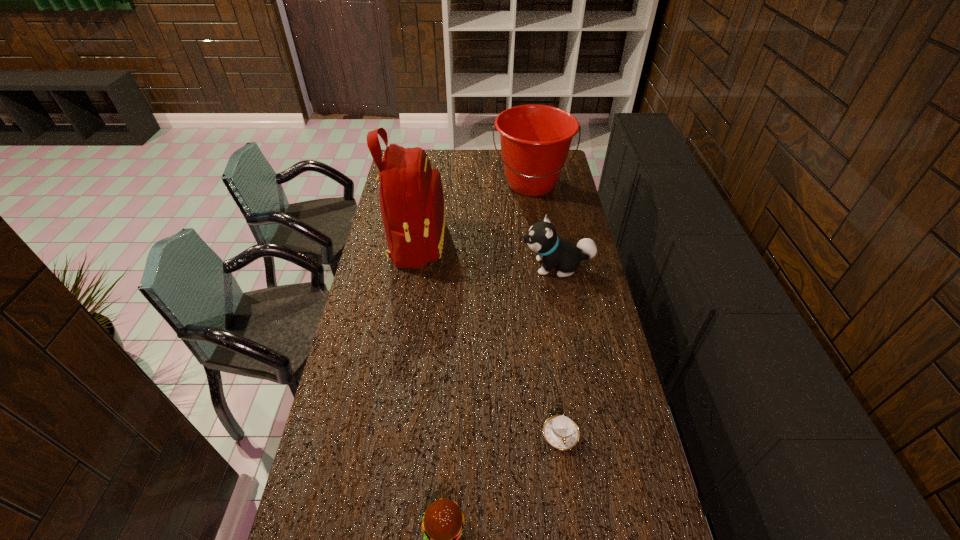
Locate an element on the screen. free location located at the face of the puppy is located at coordinates (446, 266).

You are a GUI agent. You are given a task and a screenshot of the screen. Output one action in this format:
    pyautogui.click(x=<x>, y=<y>)
    Task: Click on the free point located at the face of the puppy
    This screenshot has width=960, height=540.
    Given the screenshot: What is the action you would take?
    pyautogui.click(x=481, y=266)

The width and height of the screenshot is (960, 540). In order to click on vacant space located on the side with the handle of the teacup in this screenshot , I will do `click(574, 532)`.

Where is `object present at the far edge`? This screenshot has width=960, height=540. object present at the far edge is located at coordinates (535, 140).

Identify the location of object that is at the left edge. (411, 198).

At what (x,y) coordinates should I click in order to perform the action: click on bucket that is at the right edge. Please return your answer as a coordinate pair (x, y). Image resolution: width=960 pixels, height=540 pixels. Looking at the image, I should click on (535, 140).

Locate an element on the screen. The width and height of the screenshot is (960, 540). puppy situated at the right edge is located at coordinates (542, 238).

Identify the location of object located in the far right corner section of the desktop. Image resolution: width=960 pixels, height=540 pixels. (535, 140).

Locate an element on the screen. vacant space at the left edge is located at coordinates (338, 378).

Where is `vacant space at the right edge`? This screenshot has height=540, width=960. vacant space at the right edge is located at coordinates (650, 513).